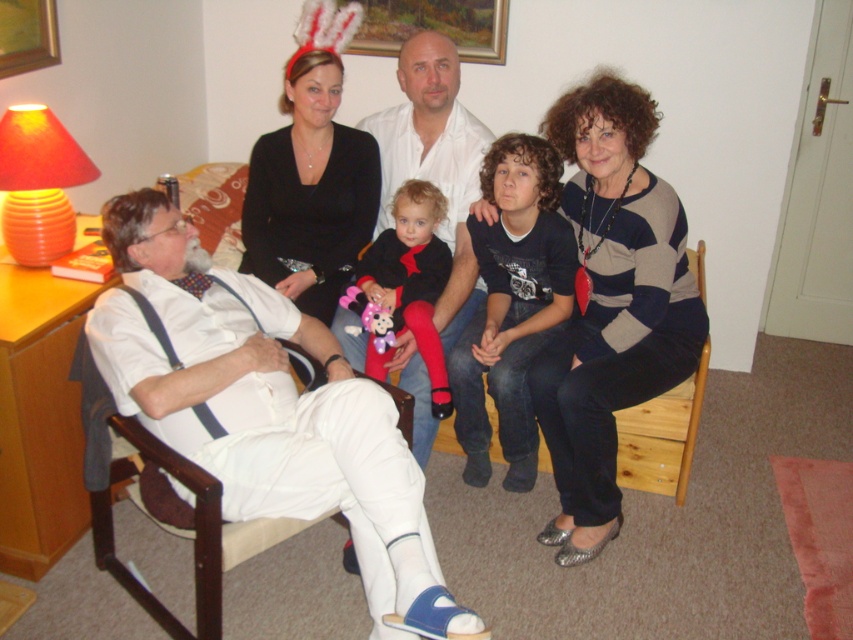
Is wooden chair at left closer to camera compared to smooth white shirt at center?

Yes, wooden chair at left is closer to the viewer.

I want to click on wooden chair at left, so click(286, 449).

Which is in front, point (320, 403) or point (438, 56)?

Point (320, 403) is in front.

You are a GUI agent. You are given a task and a screenshot of the screen. Output one action in this format:
    pyautogui.click(x=<x>, y=<y>)
    Task: Click on the wooden chair at left
    
    Given the screenshot: What is the action you would take?
    pyautogui.click(x=286, y=449)

Between point (495, 380) and point (438, 140), which one is positioned behind?

Positioned behind is point (438, 140).

Who is lower down, white matte clothing at center or smooth white shirt at center?

white matte clothing at center is below.

Who is more forward, (138,220) or (393,168)?

Point (138,220) is in front.

Image resolution: width=853 pixels, height=640 pixels. What are the coordinates of `white matte clothing at center` in the screenshot? It's located at (503, 275).

Is white matte clothing at center positioned at the back of plush pink toy at center?

No, it is in front of plush pink toy at center.

Does point (558, 264) lie behind point (361, 301)?

No.

Between point (169, 440) and point (347, 292), which one is positioned behind?

The point (347, 292) is behind.

This screenshot has width=853, height=640. In order to click on white matte clothing at center in this screenshot , I will do `click(503, 275)`.